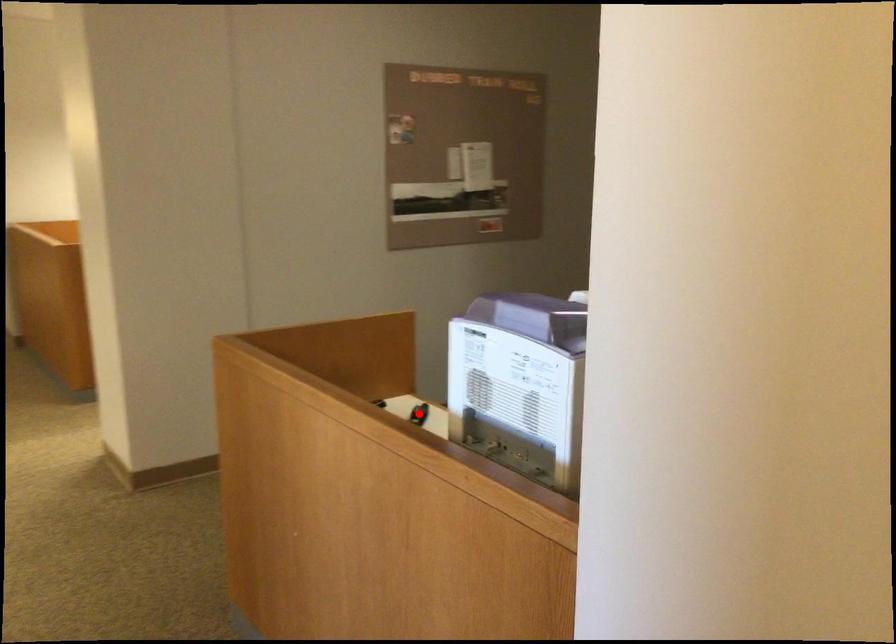
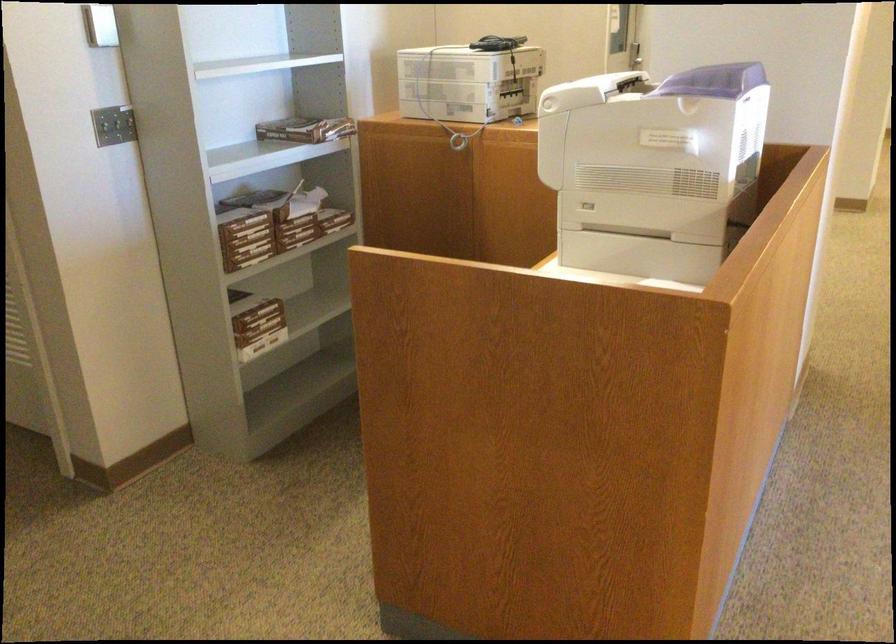
Question: I am providing you with two images of the same scene from different viewpoints. A red point is marked on the first image. Can you still see the location of the red point in image 2?

Choices:
 (A) Yes
 (B) No

Answer: (B)